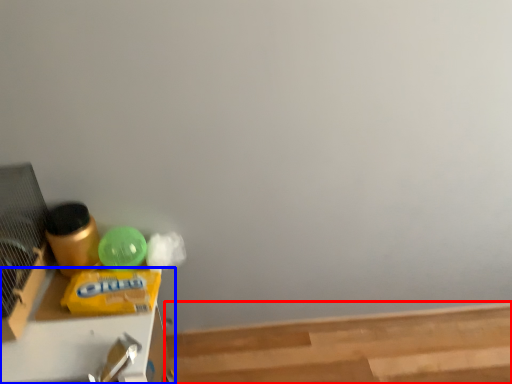
Question: Which object is closer to the camera taking this photo, wood (highlighted by a red box) or furniture (highlighted by a blue box)?

Choices:
 (A) wood
 (B) furniture

Answer: (B)